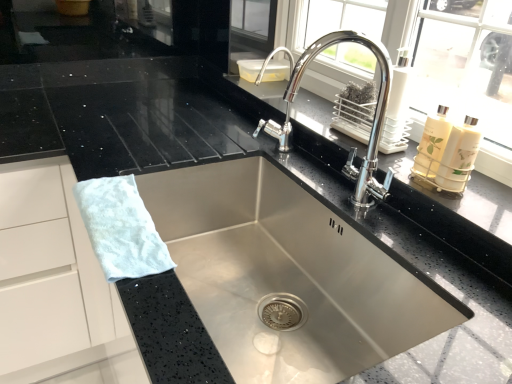
Question: From a real-world perspective, is stainless steel sink at center over polished chrome faucet at upper center?

Choices:
 (A) no
 (B) yes

Answer: (A)

Question: Could you tell me if stainless steel sink at center is turned towards polished chrome faucet at upper center?

Choices:
 (A) no
 (B) yes

Answer: (A)

Question: Can you see stainless steel sink at center touching polished chrome faucet at upper center?

Choices:
 (A) yes
 (B) no

Answer: (B)

Question: Is stainless steel sink at center positioned behind polished chrome faucet at upper center?

Choices:
 (A) yes
 (B) no

Answer: (B)

Question: Can you confirm if stainless steel sink at center is thinner than polished chrome faucet at upper center?

Choices:
 (A) yes
 (B) no

Answer: (B)

Question: Considering the positions of polished chrome faucet at upper center and white fluffy hand towel at left in the image, is polished chrome faucet at upper center bigger or smaller than white fluffy hand towel at left?

Choices:
 (A) big
 (B) small

Answer: (A)

Question: Looking at their shapes, would you say polished chrome faucet at upper center is wider or thinner than white fluffy hand towel at left?

Choices:
 (A) thin
 (B) wide

Answer: (B)

Question: From the image's perspective, relative to white fluffy hand towel at left, is polished chrome faucet at upper center above or below?

Choices:
 (A) above
 (B) below

Answer: (A)

Question: Do you think polished chrome faucet at upper center is within white fluffy hand towel at left, or outside of it?

Choices:
 (A) inside
 (B) outside

Answer: (B)

Question: Considering the relative positions of white fluffy hand towel at left and stainless steel sink at center in the image provided, is white fluffy hand towel at left to the left or to the right of stainless steel sink at center?

Choices:
 (A) right
 (B) left

Answer: (B)

Question: Is white fluffy hand towel at left situated inside stainless steel sink at center or outside?

Choices:
 (A) inside
 (B) outside

Answer: (A)

Question: In the image, is white fluffy hand towel at left positioned in front of or behind stainless steel sink at center?

Choices:
 (A) behind
 (B) front

Answer: (A)

Question: Considering the positions of white fluffy hand towel at left and stainless steel sink at center in the image, is white fluffy hand towel at left taller or shorter than stainless steel sink at center?

Choices:
 (A) tall
 (B) short

Answer: (B)

Question: From a real-world perspective, is stainless steel sink at center above or below polished chrome faucet at upper center?

Choices:
 (A) above
 (B) below

Answer: (B)

Question: Based on their sizes in the image, would you say stainless steel sink at center is bigger or smaller than polished chrome faucet at upper center?

Choices:
 (A) small
 (B) big

Answer: (B)